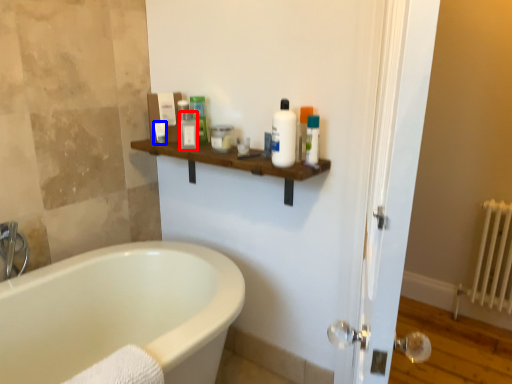
Question: Which point is closer to the camera, toiletry (highlighted by a red box) or toiletry (highlighted by a blue box)?

Choices:
 (A) toiletry
 (B) toiletry

Answer: (A)